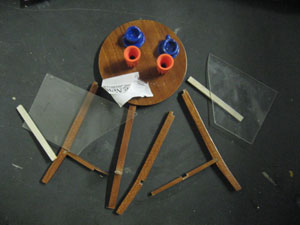
Locate an element on the screen. left blue cup is located at coordinates (133, 32).